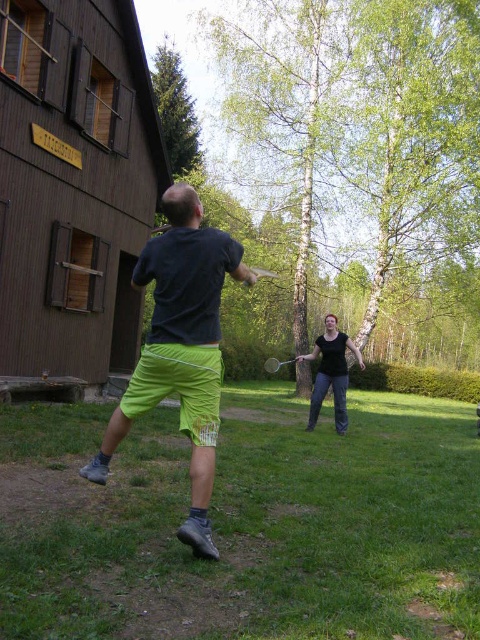
Question: Does neon green shorts at center have a greater width compared to metallic silver badminton racket at center?

Choices:
 (A) no
 (B) yes

Answer: (B)

Question: Which object is positioned farthest from the neon green shorts at center?

Choices:
 (A) metallic silver badminton racket at center
 (B) black cotton shirt at center

Answer: (A)

Question: Is black cotton shirt at center closer to the viewer compared to metallic silver badminton racket at center?

Choices:
 (A) no
 (B) yes

Answer: (B)

Question: Does neon green shorts at center appear under metallic silver badminton racket at center?

Choices:
 (A) no
 (B) yes

Answer: (A)

Question: Which object is positioned farthest from the neon green shorts at center?

Choices:
 (A) black cotton shirt at center
 (B) metallic silver badminton racket at center

Answer: (B)

Question: Which point is closer to the camera?

Choices:
 (A) (266, 371)
 (B) (240, 253)
 (C) (324, 397)

Answer: (B)